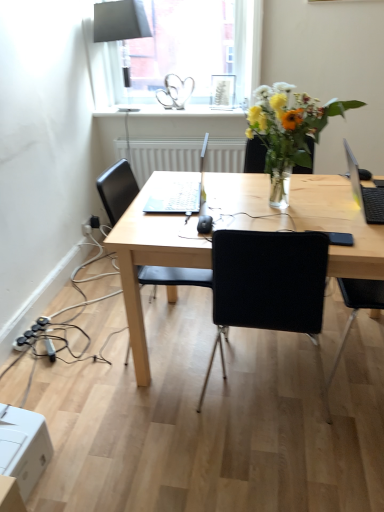
Find the location of a particular element. Image resolution: width=384 pixels, height=512 pixels. free location in front of sleek silver laptop at center is located at coordinates (168, 225).